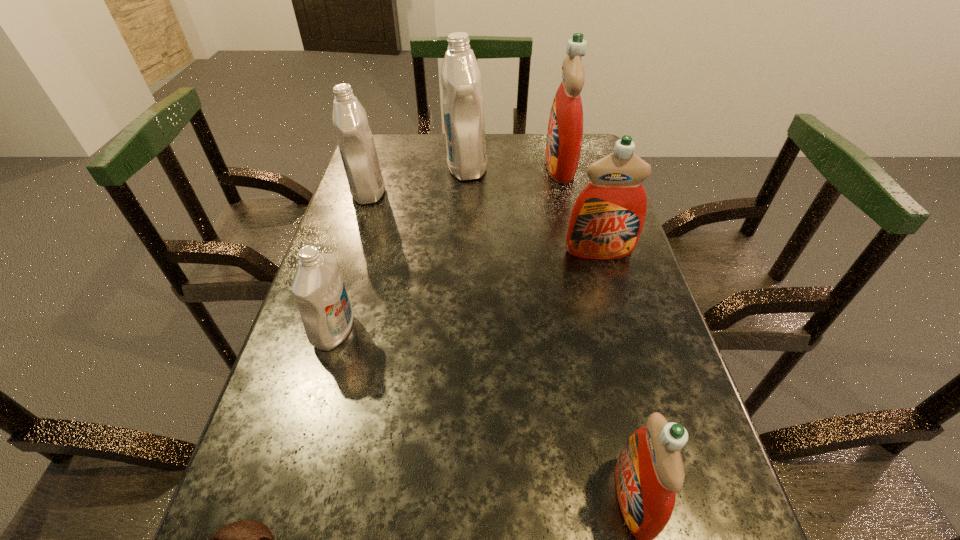
Find the location of a particular element. Image resolution: width=960 pixels, height=540 pixels. the biggest white detergent is located at coordinates pyautogui.click(x=463, y=110).

Locate an element on the screen. the fourth object from right to left is located at coordinates (463, 110).

At what (x,y) coordinates should I click in order to perform the action: click on the biggest red detergent. Please return your answer as a coordinate pair (x, y). This screenshot has height=540, width=960. Looking at the image, I should click on (565, 129).

This screenshot has width=960, height=540. I want to click on the second biggest white detergent, so click(x=350, y=121).

Find the location of `the third nearest detergent`. the third nearest detergent is located at coordinates (606, 221).

Locate an element on the screen. the second biggest red detergent is located at coordinates (606, 221).

The width and height of the screenshot is (960, 540). Identify the location of the smallest white detergent. (318, 287).

I want to click on the nearest white detergent, so click(x=318, y=287).

Locate an element on the screen. The image size is (960, 540). vacant space located 0.140m on the front of the biggest white detergent is located at coordinates (465, 213).

The image size is (960, 540). Identify the location of free space located on the front surface of the farthest red detergent. (502, 167).